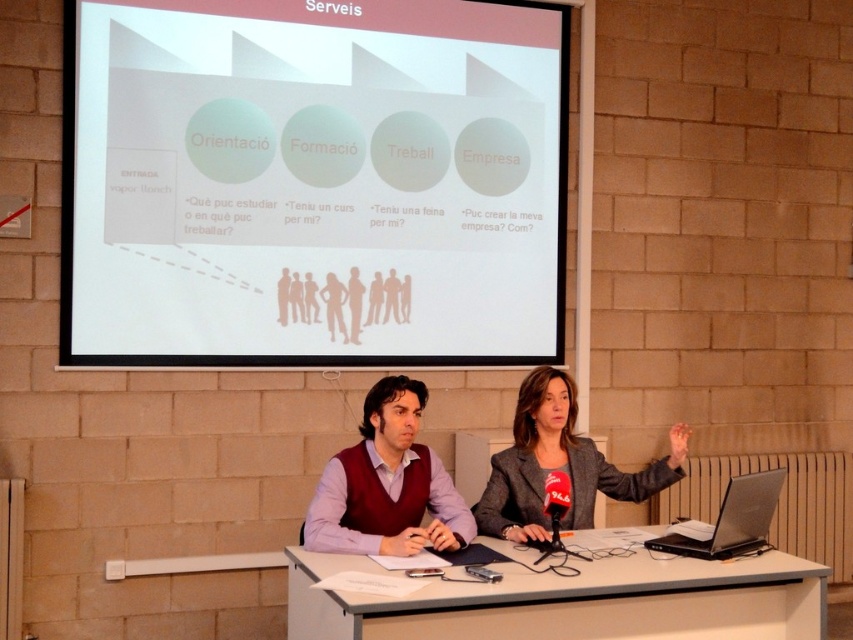
Question: Which object appears farthest from the camera in this image?

Choices:
 (A) gray fabric blazer at center
 (B) brown paper bag at center
 (C) silhouette paper people at center

Answer: (B)

Question: Is black matte microphone at center wider than brown paper bag at center?

Choices:
 (A) no
 (B) yes

Answer: (B)

Question: Is white matte projection screen at upper center wider than gray fabric blazer at center?

Choices:
 (A) no
 (B) yes

Answer: (B)

Question: Does white glossy table at center come behind light brown paper cutout figure at center?

Choices:
 (A) yes
 (B) no

Answer: (B)

Question: Estimate the real-world distances between objects in this image. Which object is closer to the light brown paper cutout figure at center?

Choices:
 (A) brown paper cutout people at center
 (B) silhouette paper people at center

Answer: (A)

Question: Which of these objects is positioned closest to the gray fabric blazer at center?

Choices:
 (A) matte beige figure at center
 (B) maroon sweater at center
 (C) silhouette figure at center
 (D) matte black figure at center

Answer: (B)